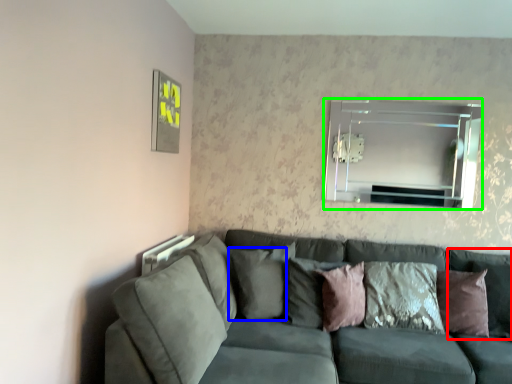
Question: Which object is the farthest from pillow (highlighted by a red box)? Choose among these: pillow (highlighted by a blue box) or mirror (highlighted by a green box).

Choices:
 (A) pillow
 (B) mirror

Answer: (A)